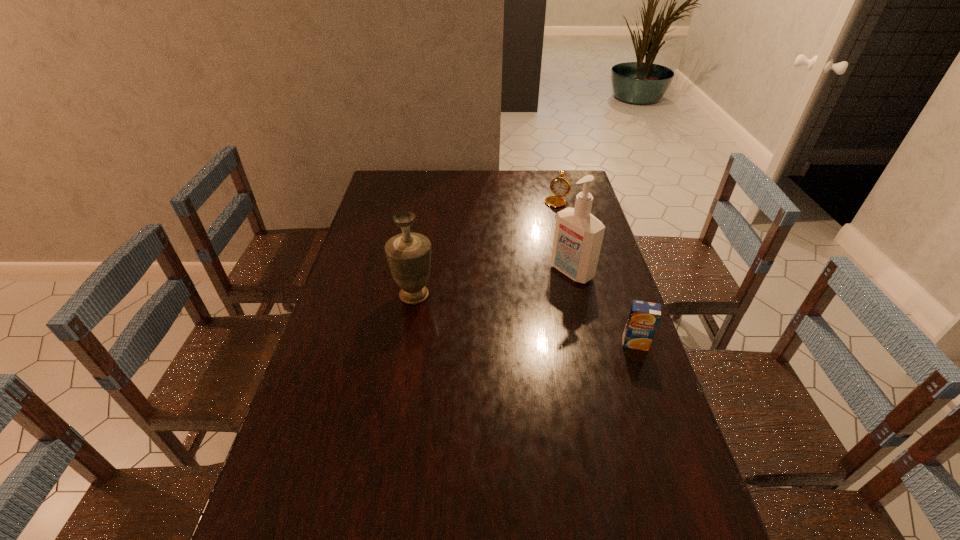
In the image, there is a desktop. Where is `blank space at the near edge`? blank space at the near edge is located at coordinates (563, 535).

What are the coordinates of `vacant area at the left edge` in the screenshot? It's located at (290, 486).

This screenshot has width=960, height=540. Find the location of `vacant space at the right edge of the desktop`. vacant space at the right edge of the desktop is located at coordinates (612, 363).

What are the coordinates of `free region at the near left corner` in the screenshot? It's located at (330, 512).

The height and width of the screenshot is (540, 960). In order to click on free space at the far right corner of the desktop in this screenshot , I will do `click(580, 179)`.

At what (x,y) coordinates should I click in order to perform the action: click on free space between the orange_juice and the urn. Please return your answer as a coordinate pair (x, y). The height and width of the screenshot is (540, 960). Looking at the image, I should click on [x=525, y=319].

The image size is (960, 540). Find the location of `vacant point located between the cleansing agent and the nearest object`. vacant point located between the cleansing agent and the nearest object is located at coordinates (604, 307).

The height and width of the screenshot is (540, 960). Identify the location of free space between the second tallest object and the cleansing agent. (493, 284).

Where is `vacant space in between the urn and the tallest object`? The image size is (960, 540). vacant space in between the urn and the tallest object is located at coordinates (493, 284).

Image resolution: width=960 pixels, height=540 pixels. Find the location of `vacant area between the farthest object and the nearest object`. vacant area between the farthest object and the nearest object is located at coordinates (599, 273).